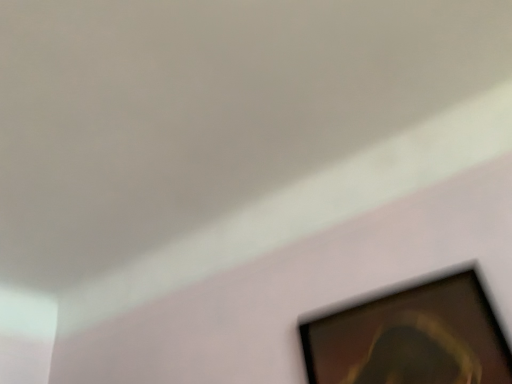
The height and width of the screenshot is (384, 512). Find the location of `wooden picture frame at lower right`. wooden picture frame at lower right is located at coordinates (411, 337).

What is the approximate width of wooden picture frame at lower right?

It is 1.89 inches.

What do you see at coordinates (411, 337) in the screenshot? I see `wooden picture frame at lower right` at bounding box center [411, 337].

I want to click on wooden picture frame at lower right, so click(x=411, y=337).